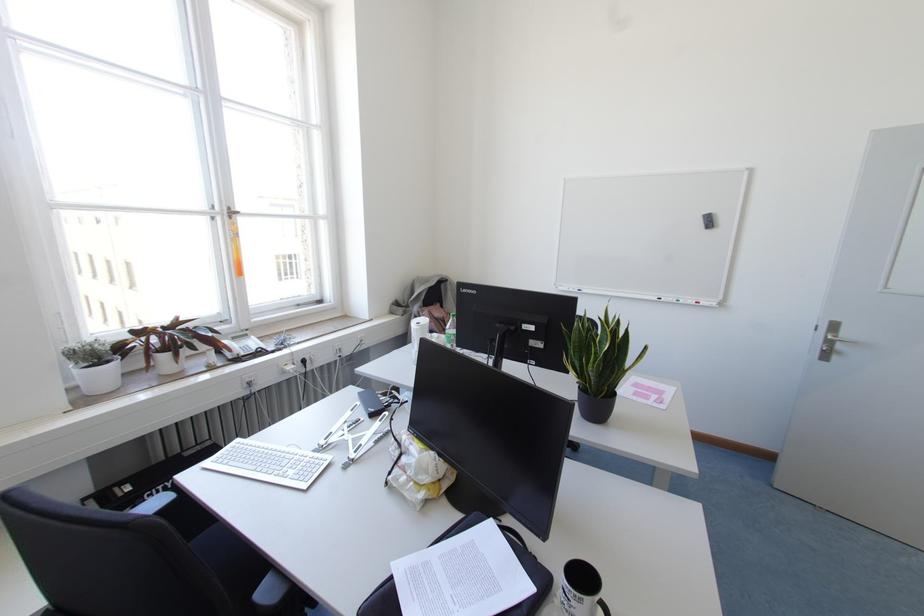
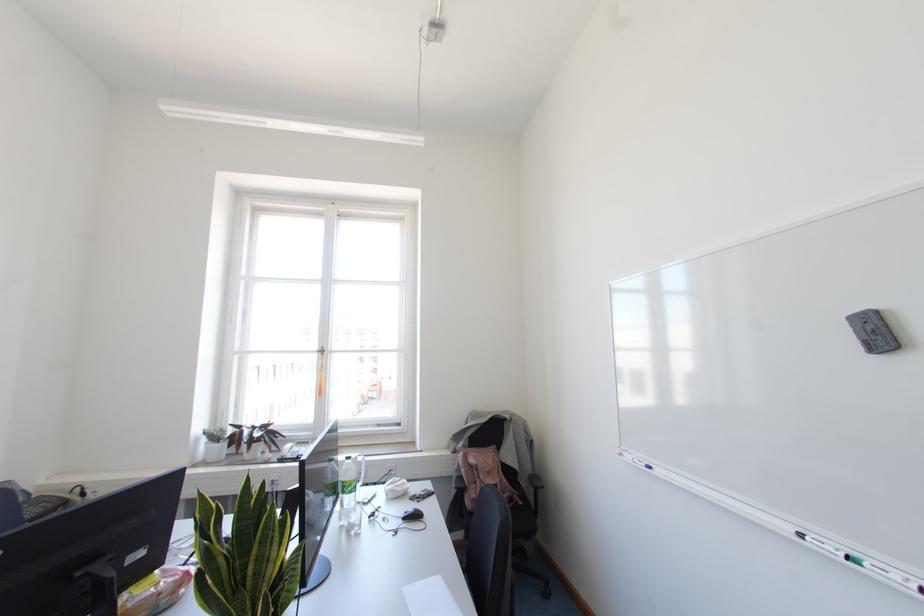
Find the pixel in the second image that matches pixel 659 299 in the first image.

(800, 536)